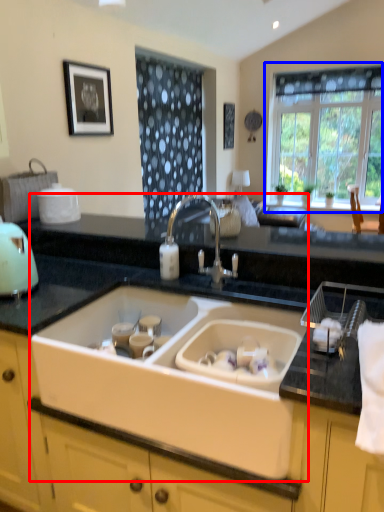
Question: Which of the following is the closest to the observer, sink (highlighted by a red box) or window (highlighted by a blue box)?

Choices:
 (A) sink
 (B) window

Answer: (A)